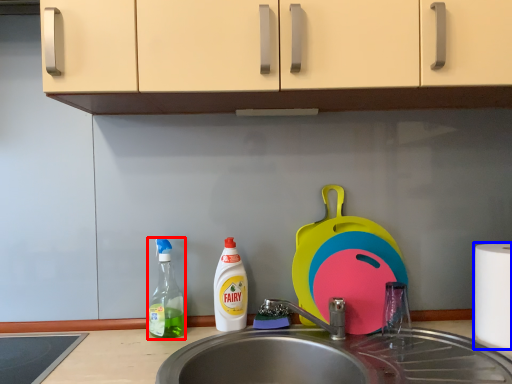
Question: Among these objects, which one is nearest to the camera, bottle (highlighted by a red box) or paper towel (highlighted by a blue box)?

Choices:
 (A) bottle
 (B) paper towel

Answer: (B)